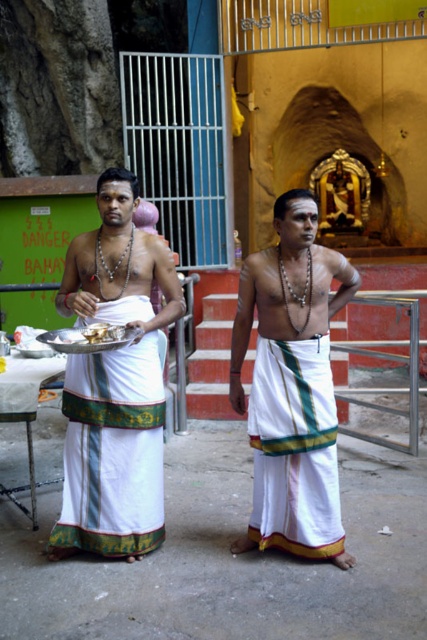
In the scene shown: You are standing at the center of the image. Which direction should you look to see the white clothed man at left?

You should look to the left to see the white clothed man at left since he is positioned at the left side of the image.

You are a photographer trying to capture a photo of the white clothed man at left and the white cotton dhoti at center. Based on their positions, which one is higher up in the frame?

The white clothed man at left is located above the white cotton dhoti at center, so he is higher up in the frame.